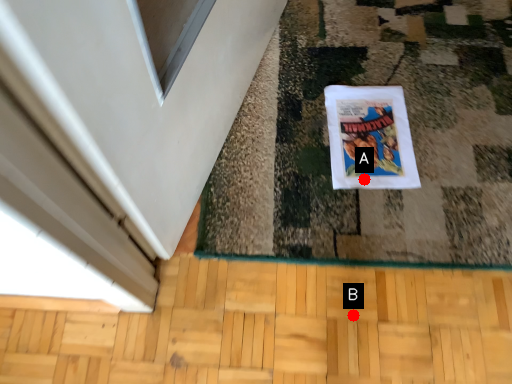
Question: Two points are circled on the image, labeled by A and B beside each circle. Which point is closer to the camera?

Choices:
 (A) A is closer
 (B) B is closer

Answer: (B)